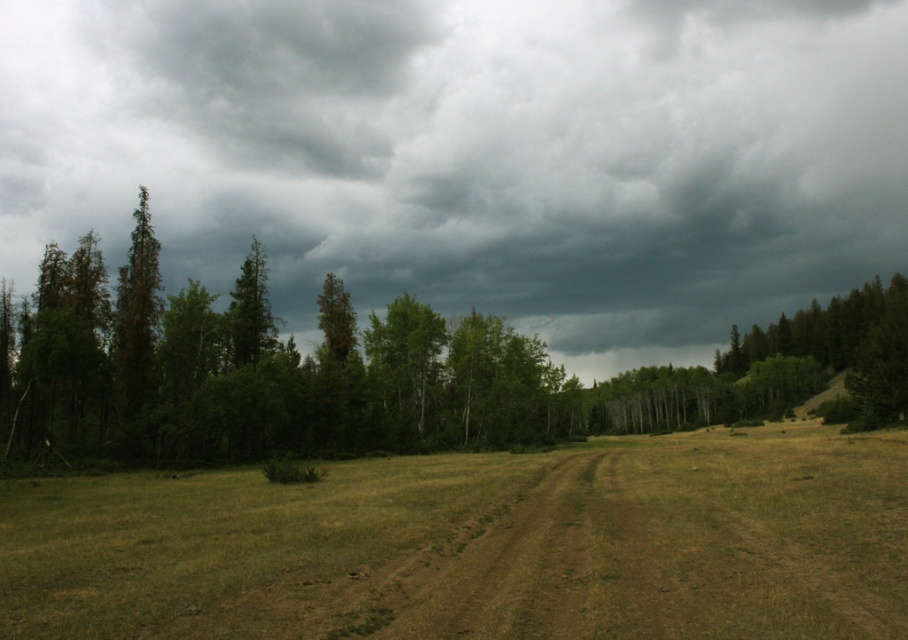
Who is more distant from viewer, [233,38] or [412,506]?

The point [233,38] is more distant.

Identify the location of dark gray cloud at upper center. The image size is (908, 640). (472, 156).

This screenshot has width=908, height=640. Describe the element at coordinates (472, 156) in the screenshot. I see `dark gray cloud at upper center` at that location.

At what (x,y) coordinates should I click in order to perform the action: click on dark gray cloud at upper center. Please return your answer as a coordinate pair (x, y). Looking at the image, I should click on (472, 156).